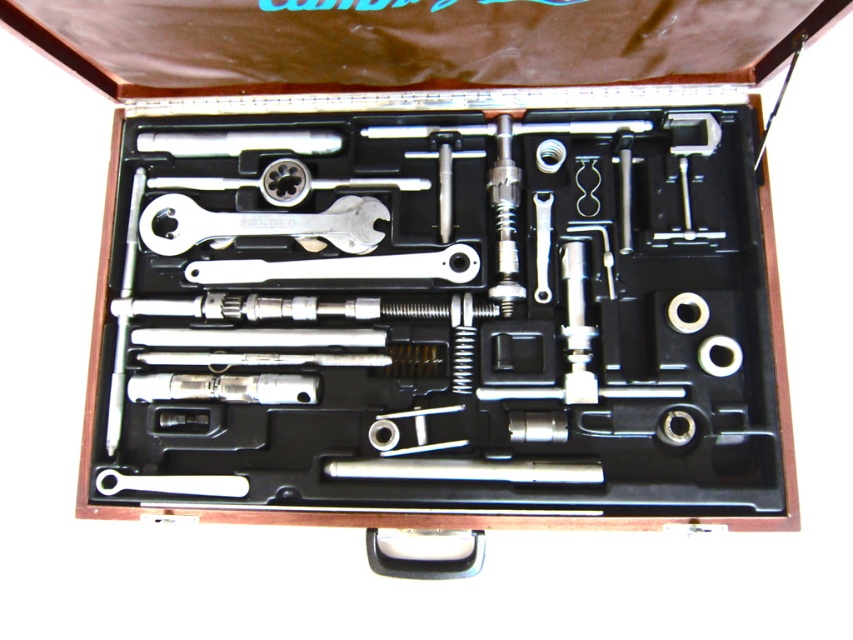
You are organizing tools in a toolbox and see the chrome metallic wrench at center and the silver metallic wrench at center. Which wrench is positioned to the left?

The chrome metallic wrench at center is positioned to the left of the silver metallic wrench at center.

You are organizing tools in the toolbox and need to place a new tool between the chrome metallic wrench at center and the silver metallic wrench at center. Which wrench should you place the new tool closer to based on their positions?

You should place the new tool closer to the silver metallic wrench at center because the chrome metallic wrench at center is closer to you, so the silver metallic wrench at center is farther away. Therefore, the new tool should be placed closer to the one that is farther to allow proper spacing.

You are a mechanic trying to reach for the polished metal rod at center and the silver metallic wrench at center inside an open toolbox. Which tool will you grab first if you want to pick the one that is nearer to your hand?

The polished metal rod at center is closer to the viewer than the silver metallic wrench at center, so you should grab the polished metal rod at center first as it is nearer to your hand.